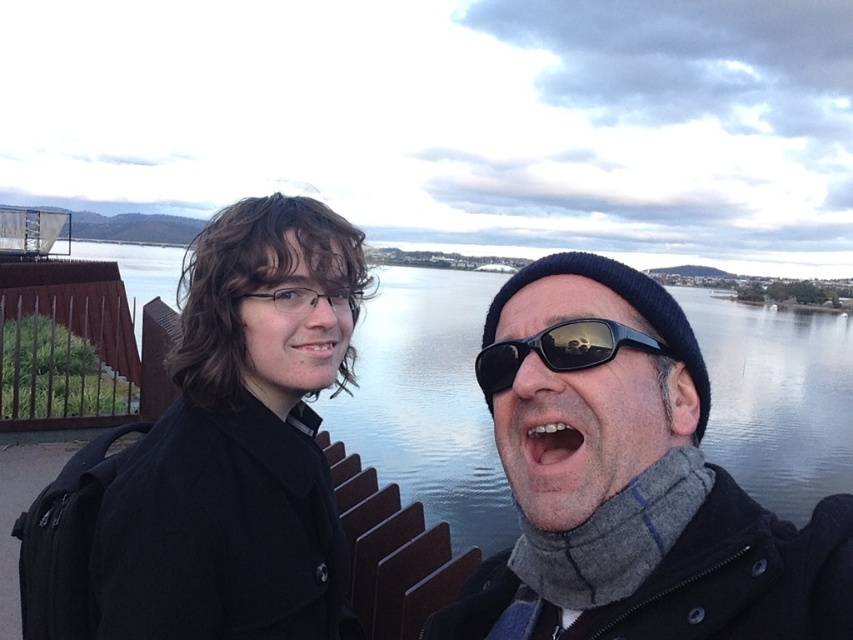
Does black reflective sunglasses at center come behind matte skin mouth at center?

No, black reflective sunglasses at center is closer to the viewer.

Locate an element on the screen. This screenshot has height=640, width=853. black reflective sunglasses at center is located at coordinates (560, 349).

Does white glossy teeth at center have a lesser height compared to matte skin mouth at center?

Correct, white glossy teeth at center is not as tall as matte skin mouth at center.

Is point (555, 460) farther from viewer compared to point (287, 342)?

No, it is in front of (287, 342).

The height and width of the screenshot is (640, 853). In order to click on white glossy teeth at center in this screenshot , I will do `click(552, 442)`.

Does matte black sunglasses at center appear on the right side of white glossy teeth at center?

Correct, you'll find matte black sunglasses at center to the right of white glossy teeth at center.

Can you confirm if matte black sunglasses at center is thinner than white glossy teeth at center?

Incorrect, matte black sunglasses at center's width is not less than white glossy teeth at center's.

The width and height of the screenshot is (853, 640). What do you see at coordinates (637, 492) in the screenshot?
I see `matte black sunglasses at center` at bounding box center [637, 492].

Locate an element on the screen. This screenshot has width=853, height=640. matte black sunglasses at center is located at coordinates (637, 492).